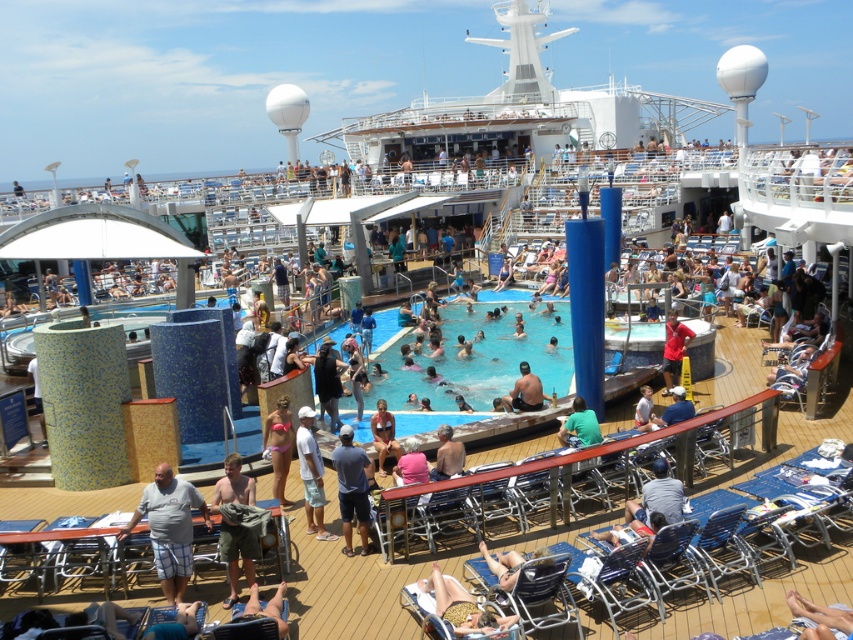
You are a photographer on the cruise ship deck. You want to take a photo of the white cotton shirt at center and the skinny man at center. Which object should you zoom in more on to ensure both are in focus?

The white cotton shirt at center has a smaller size compared to the skinny man at center, so you should zoom in more on the white cotton shirt at center to ensure both are in focus.